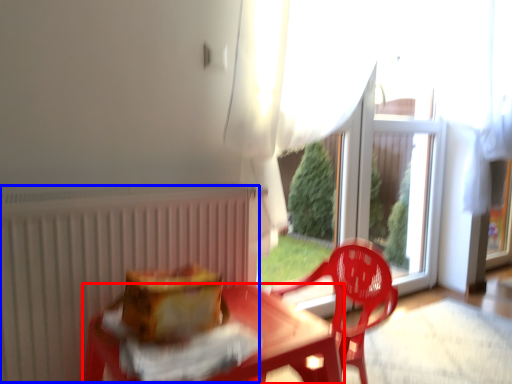
Question: Which object is closer to the camera taking this photo, table (highlighted by a red box) or radiator (highlighted by a blue box)?

Choices:
 (A) table
 (B) radiator

Answer: (A)